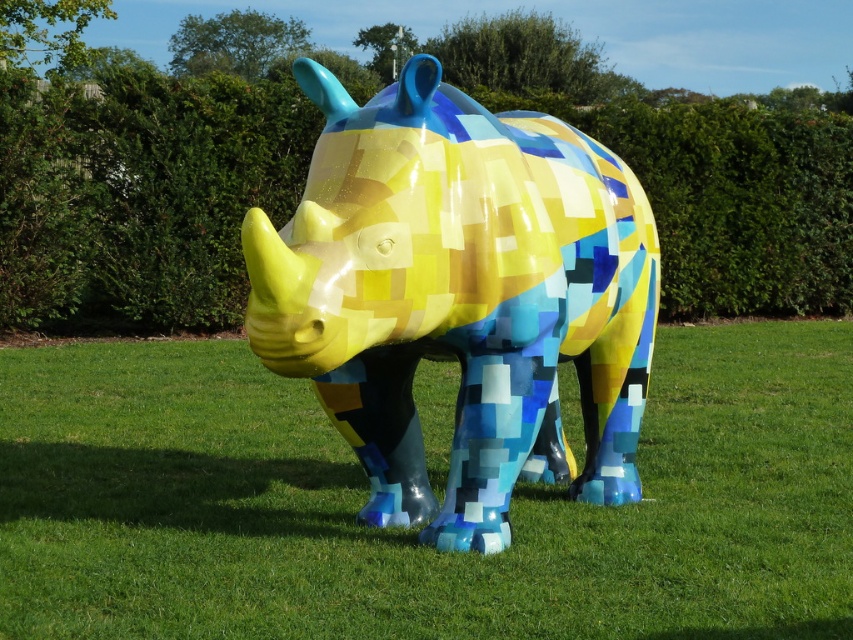
Is pixelated yellow rhino at center wider than green leafy hedge at center?

No.

Between pixelated yellow rhino at center and green leafy hedge at center, which one is positioned lower?

pixelated yellow rhino at center is lower down.

Where is `pixelated yellow rhino at center`? Image resolution: width=853 pixels, height=640 pixels. pixelated yellow rhino at center is located at coordinates (415, 529).

This screenshot has width=853, height=640. Identify the location of pixelated yellow rhino at center. (415, 529).

Is point (442, 467) more distant than point (465, 144)?

Yes, point (442, 467) is behind point (465, 144).

Between point (181, 557) and point (485, 401), which one is positioned behind?

Point (485, 401)

The image size is (853, 640). I want to click on pixelated yellow rhino at center, so click(x=415, y=529).

Is pixelated plastic rhino at center shorter than green leafy hedge at center?

Indeed, pixelated plastic rhino at center has a lesser height compared to green leafy hedge at center.

Is pixelated plastic rhino at center further to camera compared to green leafy hedge at center?

That is False.

Is point (396, 256) less distant than point (129, 189)?

Yes, point (396, 256) is in front of point (129, 189).

At what (x,y) coordinates should I click in order to perform the action: click on pixelated plastic rhino at center. Please return your answer as a coordinate pair (x, y). The height and width of the screenshot is (640, 853). Looking at the image, I should click on (460, 296).